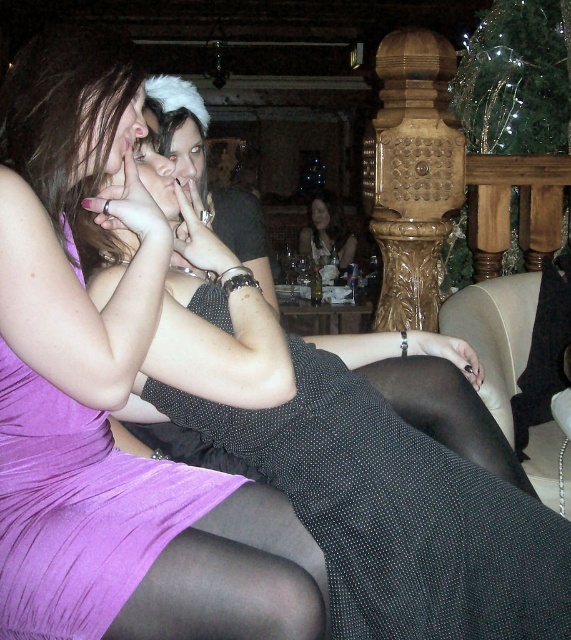
In the scene shown: You are standing at the entrance of the room and want to find the black textured dress at center. According to the coordinates provided, in which direction should you look to locate it?

The black textured dress at center is located at coordinates point (396, 513), which means it is positioned towards the lower right of the image. You should look towards the lower right direction to find it.

You are at a party and want to know which dress is more slender between the purple pleated dress at center and the matte black dress at center. Which one is thinner?

The purple pleated dress at center is thinner than the matte black dress at center.

You are at a party and want to approach the two people in the center wearing dresses. The black textured dress at center and the matte black dress at center are both in your line of sight. Which one would you need to walk around first to reach the other?

The black textured dress at center is in front of the matte black dress at center, so you would need to walk around the black textured dress at center first to reach the matte black dress at center.